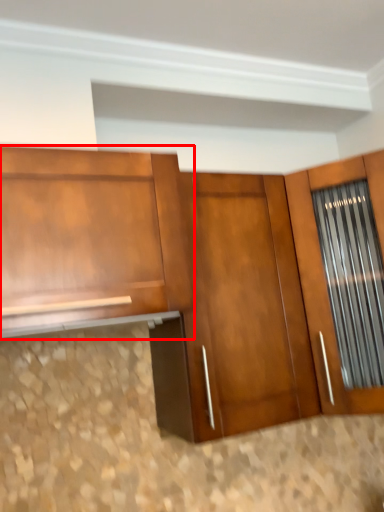
Question: Where is cabinetry (annotated by the red box) located in relation to door in the image?

Choices:
 (A) left
 (B) right

Answer: (A)